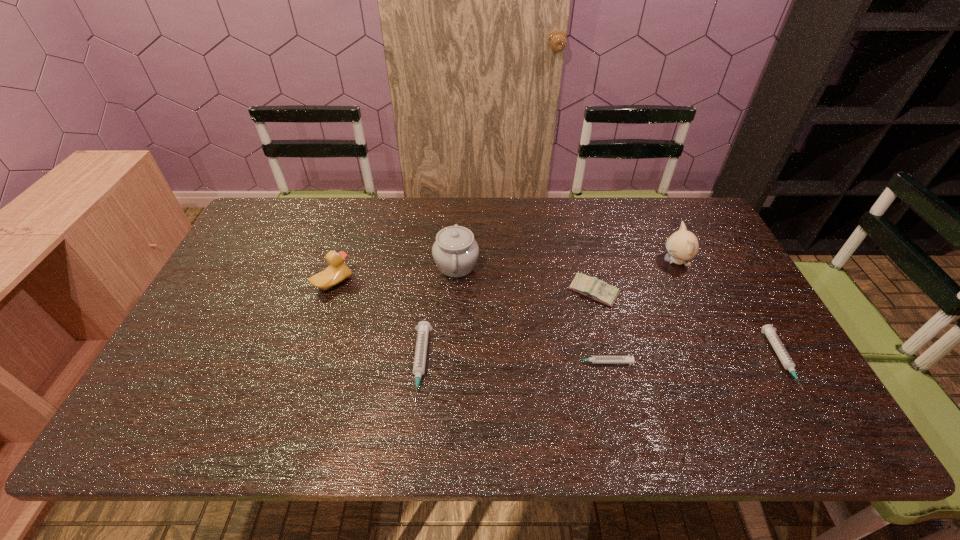
You are a GUI agent. You are given a task and a screenshot of the screen. Output one action in this format:
    pyautogui.click(x=<x>, y=<y>)
    Task: Click on the kitten
    
    Given the screenshot: What is the action you would take?
    pyautogui.click(x=683, y=245)

Find the location of a particular element. The image size is (960, 540). vacant space located at the needle end of the shortest object is located at coordinates (439, 362).

Identify the location of vacant space located at the needle end of the shortest object. (543, 362).

Locate an element on the screen. The height and width of the screenshot is (540, 960). free region located 0.130m at the needle end of the shortest object is located at coordinates (519, 362).

Find the location of a particular element. The height and width of the screenshot is (540, 960). vacant space located 0.120m on the back of the chinaware is located at coordinates (459, 222).

The height and width of the screenshot is (540, 960). Identify the location of free space located on the back of the diary. (570, 199).

The image size is (960, 540). In order to click on vacant region located at the beak of the fifth shortest object in this screenshot , I will do `click(448, 283)`.

At what (x,y) coordinates should I click in order to perform the action: click on vacant space located 0.250m on the face of the second object from right to left. Please return your answer as a coordinate pair (x, y). This screenshot has width=960, height=540. Looking at the image, I should click on (580, 261).

Find the location of a particular element. The height and width of the screenshot is (540, 960). vacant point located 0.130m on the face of the second object from right to left is located at coordinates (619, 261).

The width and height of the screenshot is (960, 540). Identify the location of free space located on the face of the second object from right to left. (564, 261).